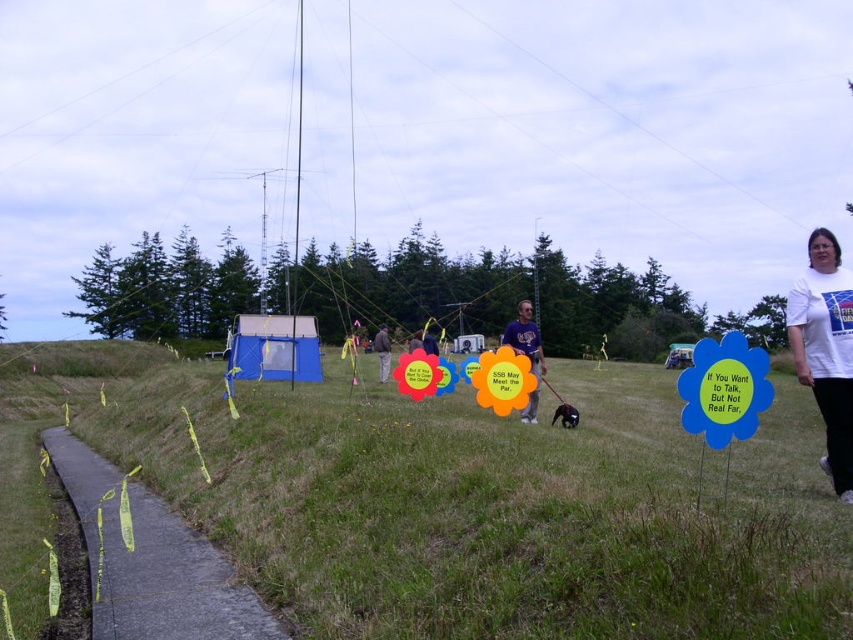
Looking at this image, who is positioned more to the left, white t-shirt at right or dark blue shirt at center?

From the viewer's perspective, dark blue shirt at center appears more on the left side.

Is white t-shirt at right to the left of dark blue shirt at center from the viewer's perspective?

Incorrect, white t-shirt at right is not on the left side of dark blue shirt at center.

Find the location of a particular element. The height and width of the screenshot is (640, 853). white t-shirt at right is located at coordinates (827, 349).

What are the coordinates of `white t-shirt at right` in the screenshot? It's located at (827, 349).

Who is positioned more to the right, green grassy at lower left or matte purple shirt at center?

matte purple shirt at center

Which is above, green grassy at lower left or matte purple shirt at center?

Positioned higher is matte purple shirt at center.

Locate an element on the screen. green grassy at lower left is located at coordinates (469, 500).

This screenshot has width=853, height=640. Describe the element at coordinates (152, 561) in the screenshot. I see `gray concrete path at lower left` at that location.

Does point (120, 536) come behind point (386, 337)?

No, it is not.

Locate an element on the screen. gray concrete path at lower left is located at coordinates (152, 561).